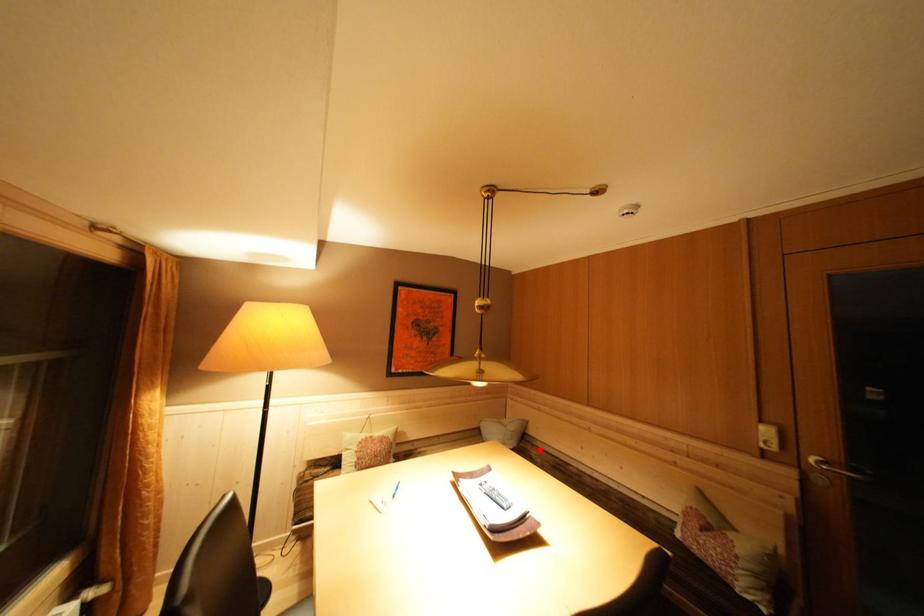
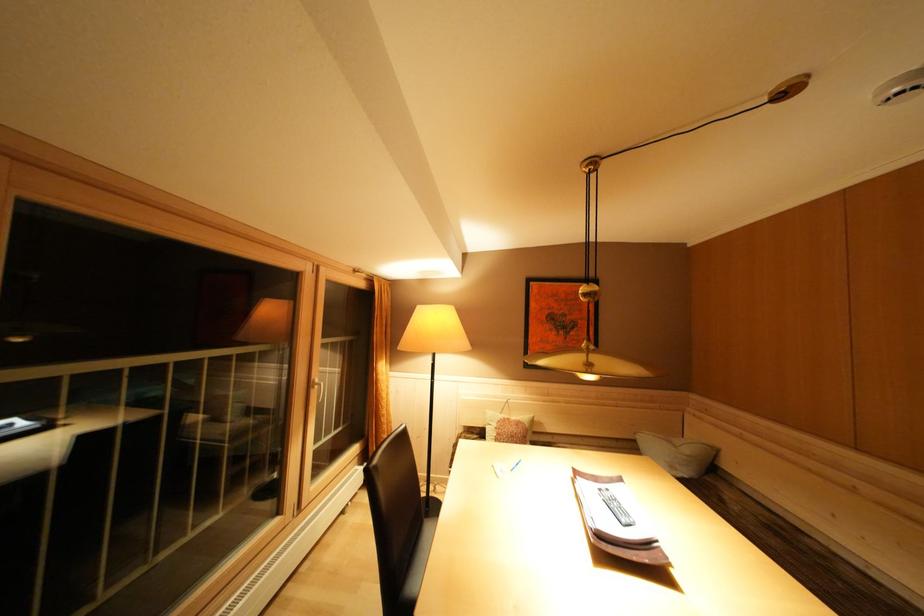
Find the pixel in the second image that matches the highlighted location in the first image.

(737, 490)